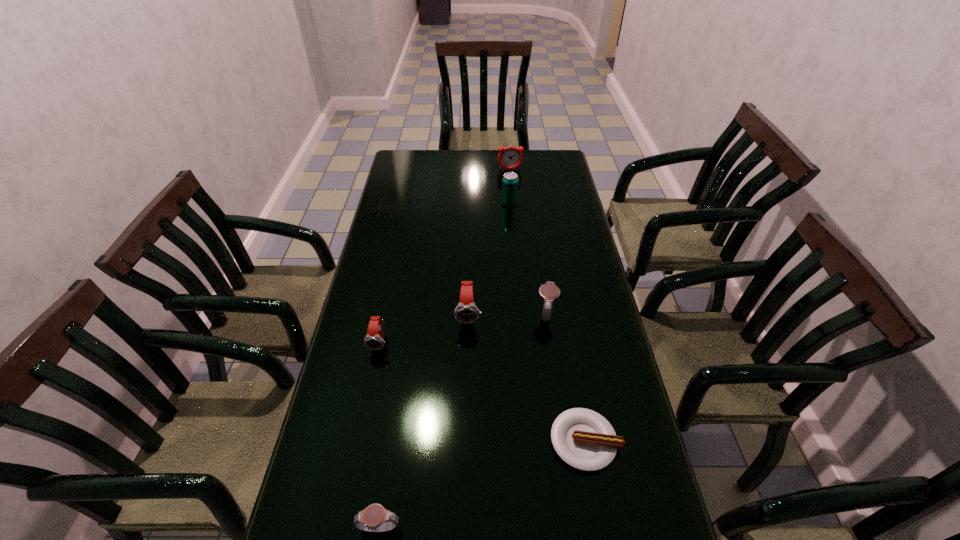
The height and width of the screenshot is (540, 960). I want to click on object that is the sixth closest to the farther gray watch, so coord(510,157).

Identify which watch is located as the third nearest to the nearer red watch. Please provide its 2D coordinates. Your answer should be formatted as a tuple, i.e. [(x, y)], where the tuple contains the x and y coordinates of a point satisfying the conditions above.

[(549, 291)]

This screenshot has width=960, height=540. In order to click on watch that is the third closest to the sixth nearest object in this screenshot , I will do click(374, 340).

You are a GUI agent. You are given a task and a screenshot of the screen. Output one action in this format:
    pyautogui.click(x=<x>, y=<y>)
    Task: Click on the free spot that satisfies the following two spatial constraints: 1. on the front-facing side of the bigger gray watch; 2. on the right side of the alarm clock
    The height and width of the screenshot is (540, 960).
    Given the screenshot: What is the action you would take?
    pyautogui.click(x=523, y=314)

Where is `free location that satisfies the following two spatial constraints: 1. on the face of the bigger gray watch; 2. on the right side of the right red watch`? The width and height of the screenshot is (960, 540). free location that satisfies the following two spatial constraints: 1. on the face of the bigger gray watch; 2. on the right side of the right red watch is located at coordinates (468, 314).

Identify the location of free location that satisfies the following two spatial constraints: 1. on the front-facing side of the sausage; 2. on the left side of the alarm clock. (536, 441).

Image resolution: width=960 pixels, height=540 pixels. I want to click on vacant space that satisfies the following two spatial constraints: 1. on the face of the third nearest object; 2. on the left side of the sixth farthest object, so click(359, 441).

Where is `blank area in the image that satisfies the following two spatial constraints: 1. on the face of the sausage; 2. on the right side of the second watch from right to left`? Image resolution: width=960 pixels, height=540 pixels. blank area in the image that satisfies the following two spatial constraints: 1. on the face of the sausage; 2. on the right side of the second watch from right to left is located at coordinates (466, 441).